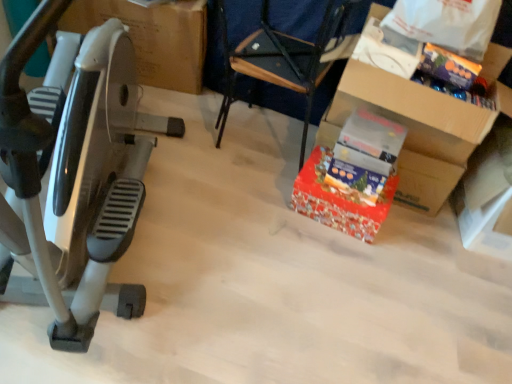
Question: Is white cardboard box at right inside the boundaries of silver metallic stationary bicycle at left, or outside?

Choices:
 (A) outside
 (B) inside

Answer: (A)

Question: Relative to silver metallic stationary bicycle at left, is white cardboard box at right in front or behind?

Choices:
 (A) behind
 (B) front

Answer: (A)

Question: Which object is the closest to the matte cardboard box at left, which is counted as the 2th cardboard box, starting from the front?

Choices:
 (A) cardboard box at right, the 2th cardboard box viewed from the back
 (B) silver metallic stationary bicycle at left
 (C) white plastic bag at upper right
 (D) white cardboard box at right
 (E) red glossy gift at center, which is the second gift in right-to-left order

Answer: (B)

Question: Based on their relative distances, which object is farther from the silver metallic stationary bicycle at left?

Choices:
 (A) red glossy gift at center, the second gift in the top-to-bottom sequence
 (B) shiny purple candy at upper right, acting as the first gift starting from the top
 (C) white plastic bag at upper right
 (D) matte cardboard box at left, arranged as the second cardboard box when viewed from the right
 (E) white cardboard box at right

Answer: (E)